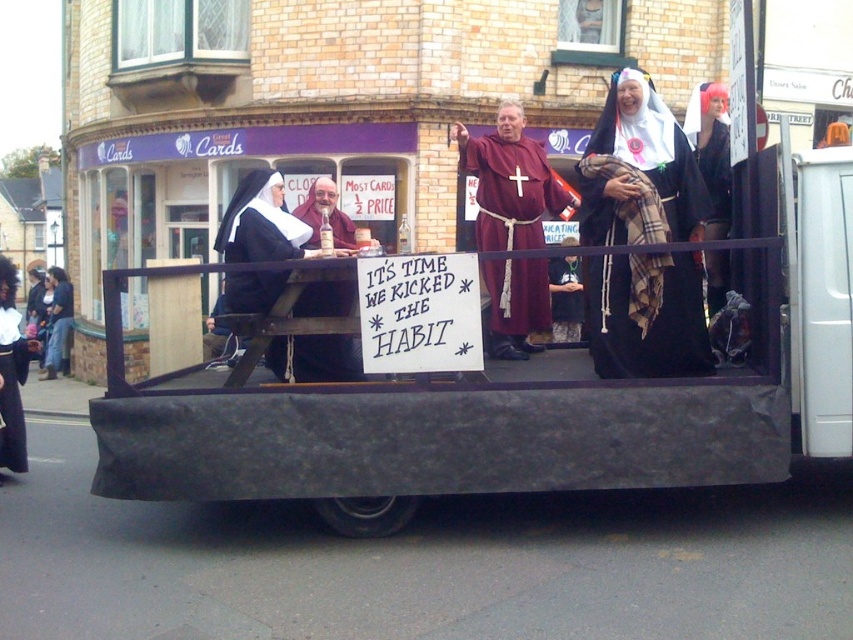
You are a photographer positioned at the front of the float. You need to capture a photo where the maroon fabric cross at center is clearly visible between the two seated figures. Based on their positions, can you determine if the cross is positioned between them?

The maroon fabric cross at center is located at point (509, 182), which is between the two seated figures, so yes, the cross is positioned between them.

You are a photographer trying to capture the float from the front. You notice two points marked on the float at coordinates point (312, 230) and point (61, 310). Which point should you focus on to ensure it appears closer to the camera in your photo?

Point (312, 230) is in front of point (61, 310), so focusing on point (312, 230) will make it appear closer to the camera in the photo.